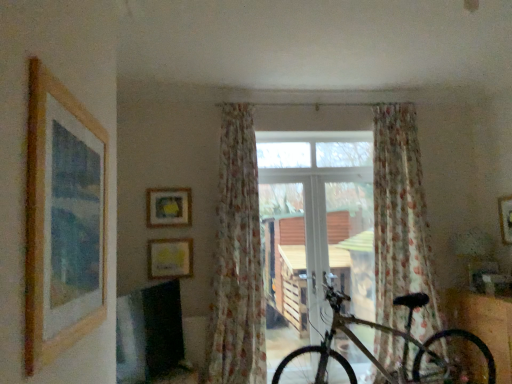
The height and width of the screenshot is (384, 512). What do you see at coordinates (170, 258) in the screenshot? I see `yellow paper at upper center, the 3th picture frame in the front-to-back sequence` at bounding box center [170, 258].

What do you see at coordinates (237, 260) in the screenshot? I see `floral sheer curtain at center, which is the 1th curtain from left to right` at bounding box center [237, 260].

The width and height of the screenshot is (512, 384). Identify the location of white plastic window at center. (316, 222).

What do you see at coordinates (484, 324) in the screenshot? The height and width of the screenshot is (384, 512). I see `metallic silver bicycle at lower right` at bounding box center [484, 324].

Where is `yellow paper at upper center, which is the 3th picture frame in right-to-left order`? This screenshot has height=384, width=512. yellow paper at upper center, which is the 3th picture frame in right-to-left order is located at coordinates (170, 258).

Is floral sheer curtain at center, which is the 1th curtain from left to right, far from wooden picture frame at right, the first picture frame in the right-to-left sequence?

Yes, floral sheer curtain at center, which is the 1th curtain from left to right, and wooden picture frame at right, the first picture frame in the right-to-left sequence, are quite far apart.

Which is more to the right, floral sheer curtain at center, which is the 1th curtain from left to right, or wooden picture frame at right, which is the 2th picture frame from front to back?

wooden picture frame at right, which is the 2th picture frame from front to back, is more to the right.

Considering the sizes of objects floral sheer curtain at center, which is the 1th curtain from left to right, and wooden picture frame at right, which is the 2th picture frame from front to back, in the image provided, who is thinner, floral sheer curtain at center, which is the 1th curtain from left to right, or wooden picture frame at right, which is the 2th picture frame from front to back,?

wooden picture frame at right, which is the 2th picture frame from front to back, is thinner.

Considering the sizes of objects floral sheer curtain at center, which is the 1th curtain from left to right, and wooden picture frame at right, arranged as the fourth picture frame when viewed from the left, in the image provided, who is taller, floral sheer curtain at center, which is the 1th curtain from left to right, or wooden picture frame at right, arranged as the fourth picture frame when viewed from the left,?

Standing taller between the two is floral sheer curtain at center, which is the 1th curtain from left to right.

From the image's perspective, which one is positioned lower, matte yellow picture frame at upper center, arranged as the first picture frame when viewed from the back, or floral sheer curtain at center, which is the 1th curtain from left to right?

From the image's view, floral sheer curtain at center, which is the 1th curtain from left to right, is below.

Looking at this image, from a real-world perspective, between matte yellow picture frame at upper center, arranged as the fourth picture frame when viewed from the front, and floral sheer curtain at center, the 2th curtain when ordered from right to left, who is vertically higher?

matte yellow picture frame at upper center, arranged as the fourth picture frame when viewed from the front, from a real-world perspective.

Considering the sizes of objects matte yellow picture frame at upper center, arranged as the fourth picture frame when viewed from the front, and floral sheer curtain at center, which is the 1th curtain from left to right, in the image provided, who is smaller, matte yellow picture frame at upper center, arranged as the fourth picture frame when viewed from the front, or floral sheer curtain at center, which is the 1th curtain from left to right,?

matte yellow picture frame at upper center, arranged as the fourth picture frame when viewed from the front.

Who is smaller, matte yellow picture frame at upper center, arranged as the first picture frame when viewed from the back, or gold metallic bicycle at center?

Smaller between the two is matte yellow picture frame at upper center, arranged as the first picture frame when viewed from the back.

From a real-world perspective, which object stands above the other?

From a 3D spatial view, matte yellow picture frame at upper center, the 4th picture frame in the right-to-left sequence, is above.

Is point (172, 222) positioned in front of point (419, 292)?

No, (172, 222) is behind (419, 292).

Considering the positions of objects matte yellow picture frame at upper center, arranged as the first picture frame when viewed from the back, and gold metallic bicycle at center in the image provided, who is behind, matte yellow picture frame at upper center, arranged as the first picture frame when viewed from the back, or gold metallic bicycle at center?

matte yellow picture frame at upper center, arranged as the first picture frame when viewed from the back, is further away from the camera.

Is point (449, 368) in front of point (93, 127)?

No.

Which of these two, gold metallic bicycle at center or wooden picture frame at left, which is the 1th picture frame from front to back, is thinner?

With smaller width is wooden picture frame at left, which is the 1th picture frame from front to back.

From a real-world perspective, which is physically below, gold metallic bicycle at center or wooden picture frame at left, which is the fourth picture frame in back-to-front order?

gold metallic bicycle at center, from a real-world perspective.

Are gold metallic bicycle at center and wooden picture frame at left, which is the 1th picture frame from front to back, located far from each other?

gold metallic bicycle at center is far away from wooden picture frame at left, which is the 1th picture frame from front to back.

Consider the image. Is metallic silver bicycle at lower right aimed at floral sheer curtain at center, the 2th curtain when ordered from right to left?

Yes, metallic silver bicycle at lower right is aimed at floral sheer curtain at center, the 2th curtain when ordered from right to left.

Locate an element on the screen. This screenshot has width=512, height=384. furniture in front of the floral sheer curtain at center, the 2th curtain when ordered from right to left is located at coordinates (484, 324).

Consider the image. From a real-world perspective, is metallic silver bicycle at lower right located higher than floral sheer curtain at center, which is the 1th curtain from left to right?

No, from a real-world perspective, metallic silver bicycle at lower right is not over floral sheer curtain at center, which is the 1th curtain from left to right

Between metallic silver bicycle at lower right and floral sheer curtain at center, which is the 1th curtain from left to right, which one appears on the left side from the viewer's perspective?

From the viewer's perspective, floral sheer curtain at center, which is the 1th curtain from left to right, appears more on the left side.

Is wooden picture frame at left, the second picture frame viewed from the right, closer to camera compared to wooden picture frame at right, which is counted as the third picture frame, starting from the back?

Yes, wooden picture frame at left, the second picture frame viewed from the right, is closer to the viewer.

Between wooden picture frame at left, which is the fourth picture frame in back-to-front order, and wooden picture frame at right, the first picture frame in the right-to-left sequence, which one appears on the left side from the viewer's perspective?

From the viewer's perspective, wooden picture frame at left, which is the fourth picture frame in back-to-front order, appears more on the left side.

Does wooden picture frame at left, the second picture frame viewed from the right, have a greater height compared to wooden picture frame at right, the first picture frame in the right-to-left sequence?

Correct, wooden picture frame at left, the second picture frame viewed from the right, is much taller as wooden picture frame at right, the first picture frame in the right-to-left sequence.

This screenshot has width=512, height=384. I want to click on the 1st curtain located beneath the wooden picture frame at left, the second picture frame viewed from the right (from a real-world perspective), so click(x=237, y=260).

From a real-world perspective, is wooden picture frame at left, which is the fourth picture frame in back-to-front order, above or below floral sheer curtain at center, the 2th curtain when ordered from right to left?

From a real-world perspective, wooden picture frame at left, which is the fourth picture frame in back-to-front order, is physically above floral sheer curtain at center, the 2th curtain when ordered from right to left.

Considering the relative positions of wooden picture frame at left, which is the fourth picture frame in back-to-front order, and floral sheer curtain at center, the 2th curtain when ordered from right to left, in the image provided, is wooden picture frame at left, which is the fourth picture frame in back-to-front order, to the left of floral sheer curtain at center, the 2th curtain when ordered from right to left, from the viewer's perspective?

Indeed, wooden picture frame at left, which is the fourth picture frame in back-to-front order, is positioned on the left side of floral sheer curtain at center, the 2th curtain when ordered from right to left.

At what (x,y) coordinates should I click in order to perform the action: click on picture frame to the right of floral sheer curtain at center, which is the 1th curtain from left to right. Please return your answer as a coordinate pair (x, y). Looking at the image, I should click on (505, 218).

From a real-world perspective, which picture frame is the 3rd one above the floral sheer curtain at center, the 2th curtain when ordered from right to left? Please provide its 2D coordinates.

[(168, 207)]

Which object lies nearer to the anchor point yellow paper at upper center, which is the 3th picture frame in right-to-left order, wooden picture frame at right, the first picture frame in the right-to-left sequence, or matte yellow picture frame at upper center, arranged as the first picture frame when viewed from the back?

matte yellow picture frame at upper center, arranged as the first picture frame when viewed from the back, is positioned closer to the anchor yellow paper at upper center, which is the 3th picture frame in right-to-left order.

Estimate the real-world distances between objects in this image. Which object is closer to matte yellow picture frame at upper center, marked as the first picture frame in a left-to-right arrangement, gold metallic bicycle at center or wooden picture frame at left, placed as the 3th picture frame when sorted from left to right?

gold metallic bicycle at center is closer to matte yellow picture frame at upper center, marked as the first picture frame in a left-to-right arrangement.

When comparing their distances from matte yellow picture frame at upper center, arranged as the fourth picture frame when viewed from the front, does metallic silver bicycle at lower right or floral sheer curtain at center, the 1th curtain when ordered from right to left, seem closer?

floral sheer curtain at center, the 1th curtain when ordered from right to left, is positioned closer to the anchor matte yellow picture frame at upper center, arranged as the fourth picture frame when viewed from the front.

When comparing their distances from white plastic window at center, does floral sheer curtain at center, which is the 2th curtain from left to right, or metallic silver bicycle at lower right seem closer?

Based on the image, floral sheer curtain at center, which is the 2th curtain from left to right, appears to be nearer to white plastic window at center.

Estimate the real-world distances between objects in this image. Which object is further from yellow paper at upper center, which is counted as the second picture frame, starting from the left, wooden picture frame at left, which is the 1th picture frame from front to back, or matte yellow picture frame at upper center, arranged as the first picture frame when viewed from the back?

wooden picture frame at left, which is the 1th picture frame from front to back, lies further to yellow paper at upper center, which is counted as the second picture frame, starting from the left, than the other object.

When comparing their distances from matte yellow picture frame at upper center, the 4th picture frame in the right-to-left sequence, does metallic silver bicycle at lower right or gold metallic bicycle at center seem closer?

gold metallic bicycle at center is positioned closer to the anchor matte yellow picture frame at upper center, the 4th picture frame in the right-to-left sequence.

From the image, which object appears to be farther from white plastic window at center, floral sheer curtain at center, which is the 1th curtain from left to right, or wooden picture frame at left, which is the fourth picture frame in back-to-front order?

wooden picture frame at left, which is the fourth picture frame in back-to-front order, lies further to white plastic window at center than the other object.

Estimate the real-world distances between objects in this image. Which object is closer to floral sheer curtain at center, the 2th curtain when ordered from right to left, wooden picture frame at left, which is the fourth picture frame in back-to-front order, or wooden picture frame at right, which is counted as the third picture frame, starting from the back?

wooden picture frame at left, which is the fourth picture frame in back-to-front order.

This screenshot has width=512, height=384. I want to click on furniture situated between wooden picture frame at left, placed as the 3th picture frame when sorted from left to right, and wooden picture frame at right, which is the 2th picture frame from front to back, from left to right, so click(484, 324).

Locate an element on the screen. Image resolution: width=512 pixels, height=384 pixels. window frame situated between matte yellow picture frame at upper center, marked as the first picture frame in a left-to-right arrangement, and floral sheer curtain at center, which is the 2th curtain from left to right, from left to right is located at coordinates (316, 222).

This screenshot has width=512, height=384. I want to click on curtain situated between matte yellow picture frame at upper center, arranged as the fourth picture frame when viewed from the front, and white plastic window at center from left to right, so click(237, 260).

What are the coordinates of `window frame located between yellow paper at upper center, the 3th picture frame in the front-to-back sequence, and metallic silver bicycle at lower right in the left-right direction` in the screenshot? It's located at (316, 222).